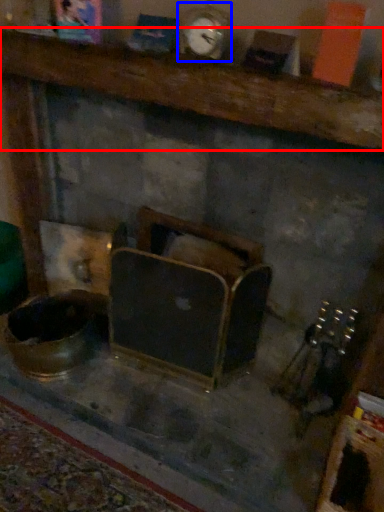
Question: Among these objects, which one is nearest to the camera, furniture (highlighted by a red box) or clock (highlighted by a blue box)?

Choices:
 (A) furniture
 (B) clock

Answer: (A)